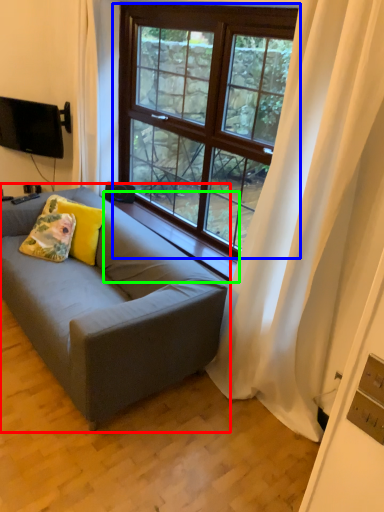
Question: Estimate the real-world distances between objects in this image. Which object is farther from studio couch (highlighted by a red box), window (highlighted by a blue box) or window sill (highlighted by a green box)?

Choices:
 (A) window
 (B) window sill

Answer: (A)